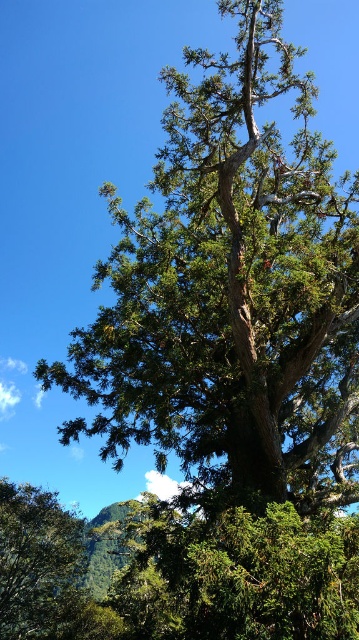
Who is lower down, green rough bark tree at center or green textured tree at lower left?

green textured tree at lower left

Is green rough bark tree at center below green textured tree at lower left?

No.

Where is `green rough bark tree at center`? The image size is (359, 640). green rough bark tree at center is located at coordinates (230, 285).

Find the location of a particular element. The width and height of the screenshot is (359, 640). green rough bark tree at center is located at coordinates (230, 285).